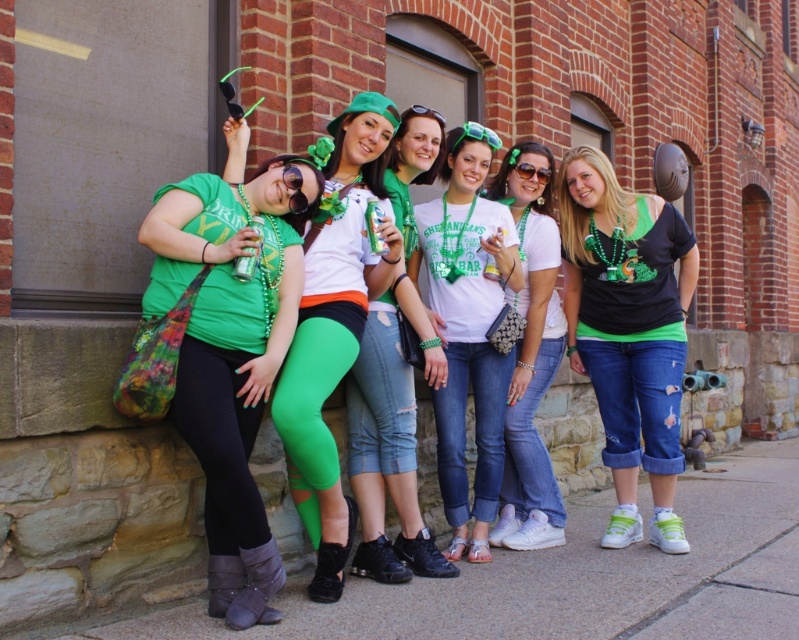
You are a photographer standing at the center of the scene. You want to take a photo focusing on the green matte leggings at center. Based on their position coordinates, where should you aim your camera?

The green matte leggings at center are located at coordinates point (x=332, y=328), so you should aim your camera towards that point to capture them.